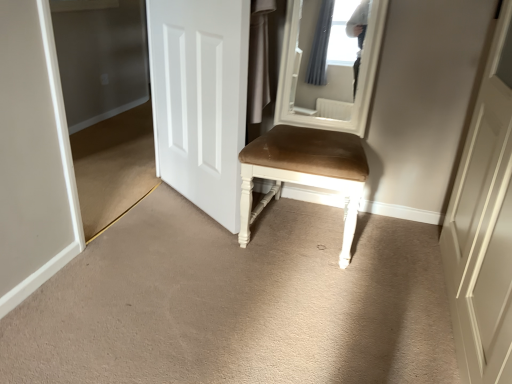
What do you see at coordinates (106, 105) in the screenshot? This screenshot has height=384, width=512. I see `transparent glass door at left` at bounding box center [106, 105].

Measure the distance between suede-like brown chair at center and camera.

They are 1.53 meters apart.

The image size is (512, 384). I want to click on transparent glass door at left, so click(x=106, y=105).

Are transparent glass door at left and suede-like brown chair at center far apart?

Yes, transparent glass door at left and suede-like brown chair at center are located far from each other.

Is transparent glass door at left turned away from suede-like brown chair at center?

transparent glass door at left is not turned away from suede-like brown chair at center.

From a real-world perspective, which object stands above the other?

In real-world perspective, transparent glass door at left is above.

Considering the relative sizes of transparent glass door at left and suede-like brown chair at center in the image provided, is transparent glass door at left wider than suede-like brown chair at center?

No, transparent glass door at left is not wider than suede-like brown chair at center.

Which point is more distant from viewer, (x=233, y=174) or (x=310, y=173)?

The point (x=233, y=174) is farther.

Which of these two, white matte door at center or suede-like brown chair at center, is wider?

suede-like brown chair at center is wider.

Can you tell me how much white matte door at center and suede-like brown chair at center differ in facing direction?

There is a 36.4-degree angle between the facing directions of white matte door at center and suede-like brown chair at center.

Which object is further away from the camera taking this photo, white matte door at center or suede-like brown chair at center?

Positioned behind is white matte door at center.

Is suede-like brown chair at center at the right side of transparent glass door at left?

Correct, you'll find suede-like brown chair at center to the right of transparent glass door at left.

Considering the positions of objects suede-like brown chair at center and transparent glass door at left in the image provided, who is in front, suede-like brown chair at center or transparent glass door at left?

suede-like brown chair at center is in front.

Considering the positions of point (95, 70) and point (204, 183), is point (95, 70) closer or farther from the camera than point (204, 183)?

Point (95, 70) appears to be farther away from the viewer than point (204, 183).

Would you say transparent glass door at left is a long distance from white matte door at center?

No, transparent glass door at left is not far from white matte door at center.

Is transparent glass door at left behind white matte door at center?

That is False.

From a real-world perspective, which is physically below, transparent glass door at left or white matte door at center?

transparent glass door at left is physically lower.

From the image's perspective, is suede-like brown chair at center over white matte door at center?

No, from the image's perspective, suede-like brown chair at center is not on top of white matte door at center.

From a real-world perspective, is suede-like brown chair at center below white matte door at center?

Yes, from a real-world perspective, suede-like brown chair at center is beneath white matte door at center.

Which object is thinner, suede-like brown chair at center or white matte door at center?

With smaller width is white matte door at center.

Is the depth of white matte door at center greater than that of transparent glass door at left?

That is True.

In the image, is white matte door at center on the left side or the right side of transparent glass door at left?

In the image, white matte door at center appears on the right side of transparent glass door at left.

From the image's perspective, is white matte door at center located above or below transparent glass door at left?

Based on their image positions, white matte door at center is located above transparent glass door at left.

Which is behind, point (201, 165) or point (105, 227)?

The point (201, 165) is farther from the camera.

At what (x,y) coordinates should I click in order to perform the action: click on chair that appears on the right of transparent glass door at left. Please return your answer as a coordinate pair (x, y). This screenshot has height=384, width=512. Looking at the image, I should click on (304, 172).

This screenshot has height=384, width=512. I want to click on door located above the suede-like brown chair at center (from a real-world perspective), so click(200, 99).

Which object lies nearer to the anchor point suede-like brown chair at center, transparent glass door at left or white matte door at center?

white matte door at center is closer to suede-like brown chair at center.

Considering their positions, is white matte door at center positioned closer to suede-like brown chair at center than transparent glass door at left?

Based on the image, white matte door at center appears to be nearer to suede-like brown chair at center.

Based on their spatial positions, is white matte door at center or suede-like brown chair at center further from transparent glass door at left?

suede-like brown chair at center is positioned further to the anchor transparent glass door at left.

Looking at the image, which one is located closer to transparent glass door at left, suede-like brown chair at center or white matte door at center?

white matte door at center lies closer to transparent glass door at left than the other object.

Considering their positions, is suede-like brown chair at center positioned further to white matte door at center than transparent glass door at left?

transparent glass door at left is positioned further to the anchor white matte door at center.

Looking at the image, which one is located closer to white matte door at center, transparent glass door at left or suede-like brown chair at center?

suede-like brown chair at center is positioned closer to the anchor white matte door at center.

Where is `door situated between transparent glass door at left and suede-like brown chair at center from left to right`? Image resolution: width=512 pixels, height=384 pixels. door situated between transparent glass door at left and suede-like brown chair at center from left to right is located at coordinates tap(200, 99).